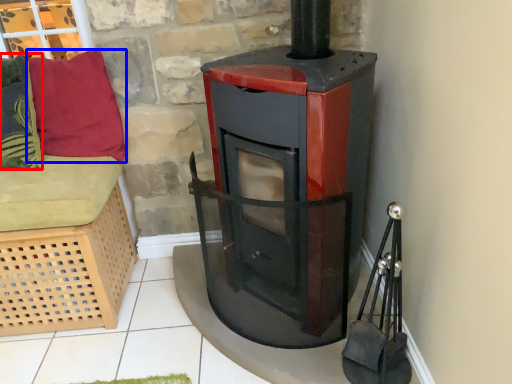
Question: Which point is further to the camera, pillow (highlighted by a red box) or pillow (highlighted by a blue box)?

Choices:
 (A) pillow
 (B) pillow

Answer: (B)